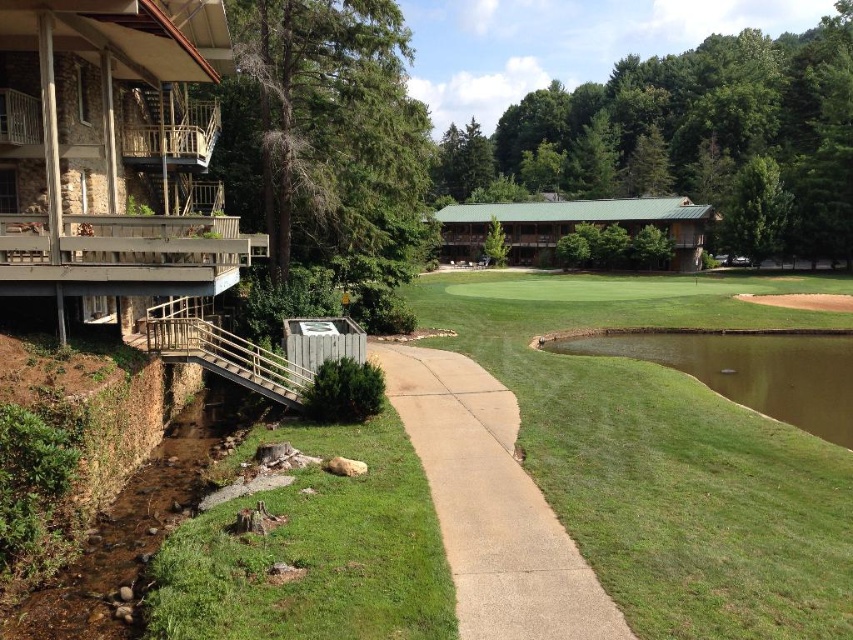
Question: Which object appears farthest from the camera in this image?

Choices:
 (A) gray concrete sidewalk at center
 (B) green grassy golf course at center

Answer: (B)

Question: Does green grassy golf course at center have a larger size compared to gray concrete sidewalk at center?

Choices:
 (A) yes
 (B) no

Answer: (A)

Question: Considering the real-world distances, which object is farthest from the green grassy water at right?

Choices:
 (A) green grassy golf course at center
 (B) gray concrete sidewalk at center

Answer: (B)

Question: From the image, what is the correct spatial relationship of green grassy golf course at center in relation to green grassy water at right?

Choices:
 (A) below
 (B) above

Answer: (B)

Question: Is gray concrete sidewalk at center smaller than green grassy water at right?

Choices:
 (A) yes
 (B) no

Answer: (A)

Question: Which object appears farthest from the camera in this image?

Choices:
 (A) gray concrete sidewalk at center
 (B) green grassy water at right

Answer: (B)